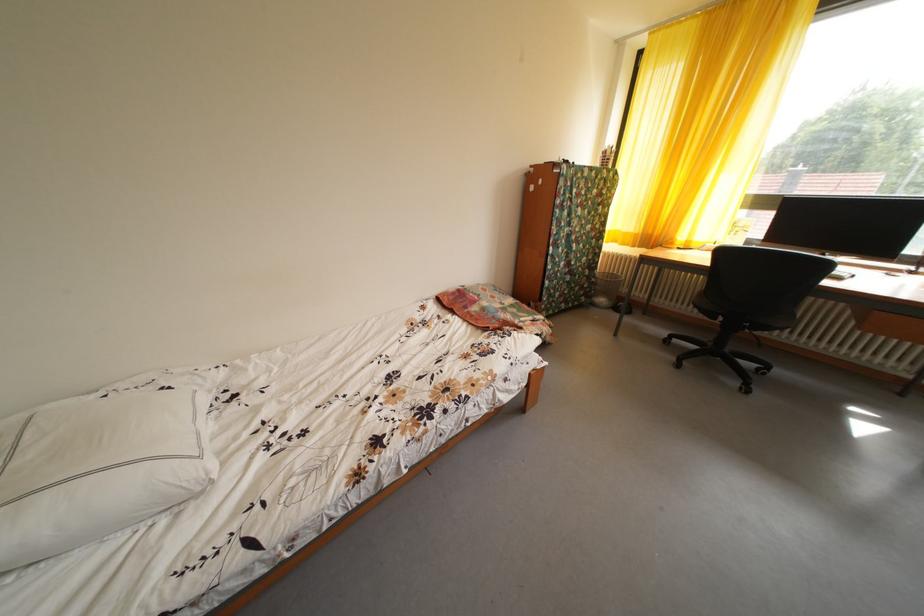
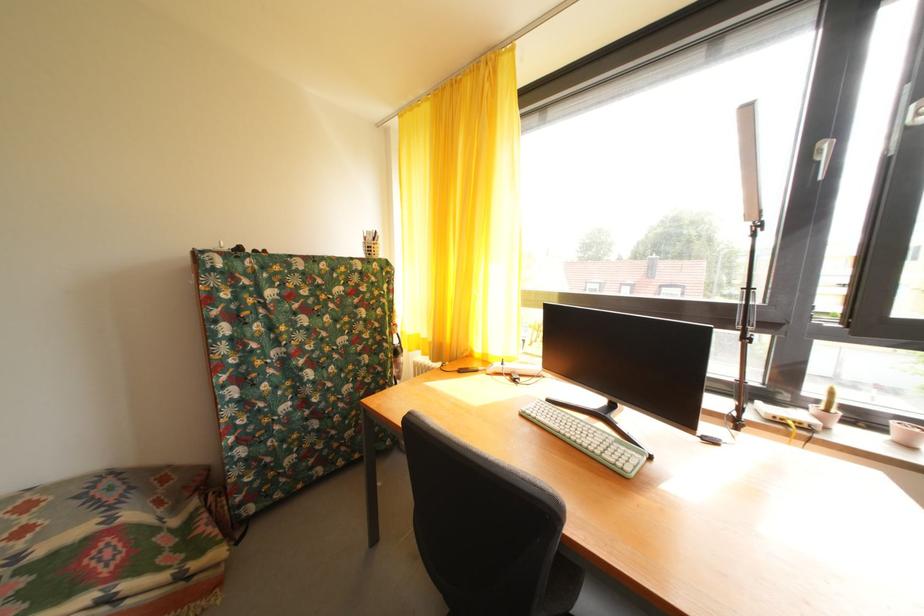
Find the pixel in the second image that matches point (502, 302) in the first image.

(31, 538)